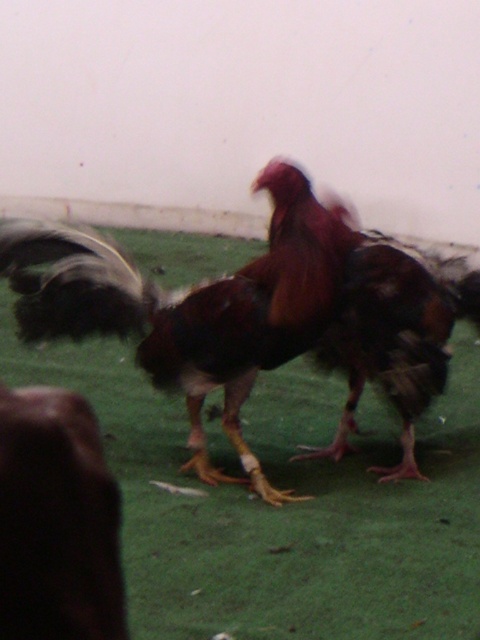
Question: Which object is farther from the camera taking this photo?

Choices:
 (A) green artificial turf at center
 (B) brown feathered rooster at center

Answer: (B)

Question: Observing the image, what is the correct spatial positioning of green artificial turf at center in reference to brown feathered rooster at center?

Choices:
 (A) left
 (B) right

Answer: (B)

Question: Can you confirm if green artificial turf at center is positioned to the left of brown feathered rooster at center?

Choices:
 (A) yes
 (B) no

Answer: (B)

Question: In this image, where is green artificial turf at center located relative to brown feathered rooster at center?

Choices:
 (A) right
 (B) left

Answer: (A)